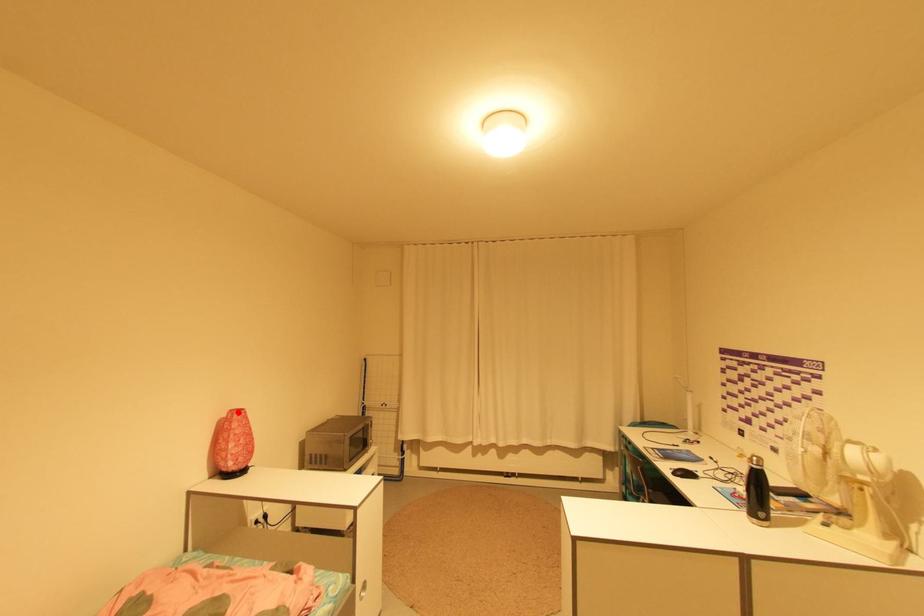
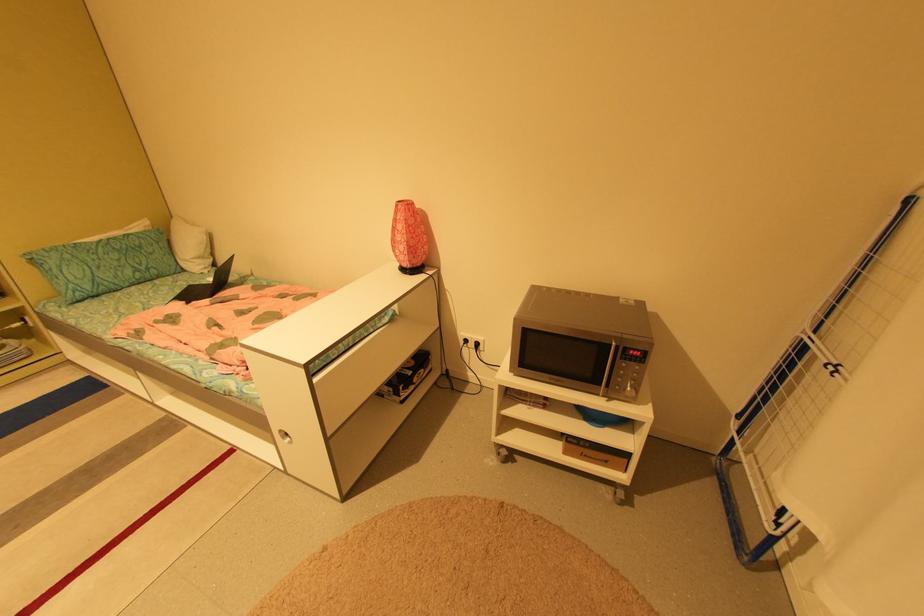
Where in the second image is the point corresponding to the highlighted location from the first image?

(406, 201)